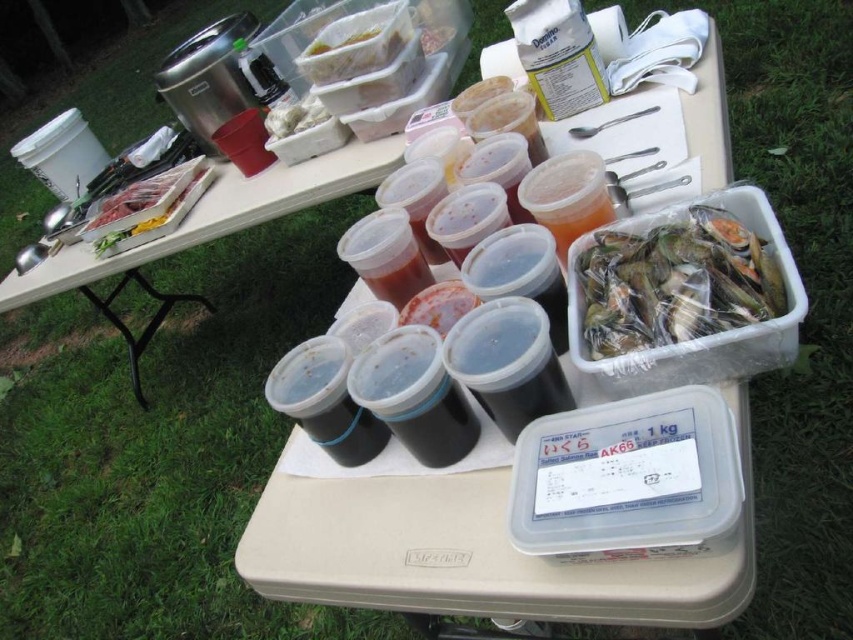
Is clear plastic bag of fish at center-right above translucent plastic cup at center?

Yes.

Between point (735, 305) and point (454, 288), which one is positioned behind?

The point (454, 288) is more distant.

This screenshot has width=853, height=640. Identify the location of clear plastic bag of fish at center-right. (676, 282).

Can you confirm if clear plastic cups at center is taller than translucent plastic cup at center?

Correct, clear plastic cups at center is much taller as translucent plastic cup at center.

Is clear plastic cups at center positioned at the back of translucent plastic cup at center?

Yes.

Does point (136, 380) lie behind point (410, 308)?

That is True.

Find the location of a particular element. clear plastic cups at center is located at coordinates (206, 230).

Is point (436, 292) positioned in front of point (399, 36)?

That is True.

Between translucent plastic cup at center and clear plastic container at upper center, which one appears on the left side from the viewer's perspective?

clear plastic container at upper center is more to the left.

Who is more distant from viewer, (457, 310) or (357, 64)?

Positioned behind is point (357, 64).

Identify the location of translucent plastic cup at center. (438, 305).